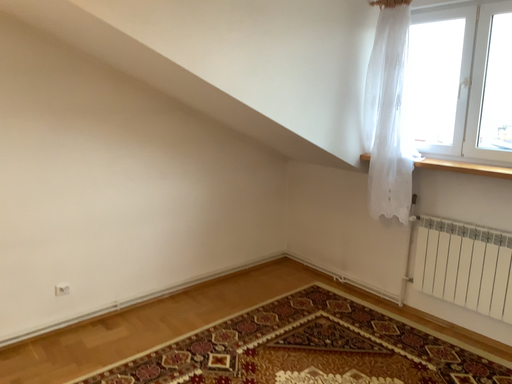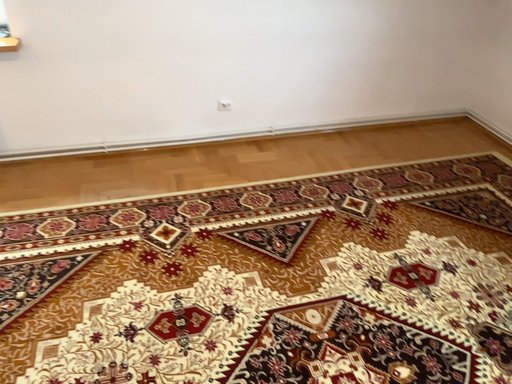
Question: Which way did the camera rotate in the video?

Choices:
 (A) rotated upward
 (B) rotated downward

Answer: (B)